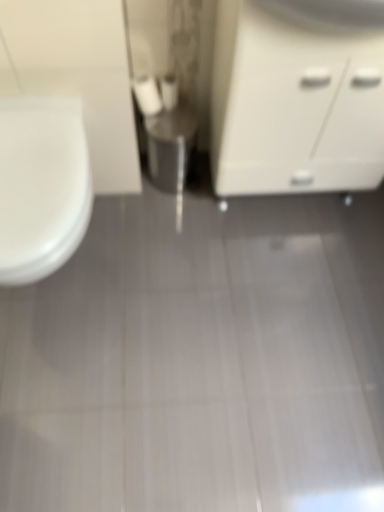
Question: Would you say white matte toilet paper at center, placed as the 1th toilet paper when sorted from right to left, is inside or outside white matte cabinet at right?

Choices:
 (A) inside
 (B) outside

Answer: (B)

Question: From a real-world perspective, is white matte toilet paper at center, placed as the 1th toilet paper when sorted from right to left, above or below white matte cabinet at right?

Choices:
 (A) above
 (B) below

Answer: (B)

Question: Which object is the closest to the white glossy toilet at left?

Choices:
 (A) white matte toilet paper at center, which is the second toilet paper in right-to-left order
 (B) white matte cabinet at right
 (C) white matte toilet paper at center, the 2th toilet paper in the left-to-right sequence

Answer: (A)

Question: Which object is positioned farthest from the white glossy toilet at left?

Choices:
 (A) white matte toilet paper at center, the first toilet paper viewed from the left
 (B) white matte cabinet at right
 (C) white matte toilet paper at center, the 2th toilet paper in the left-to-right sequence

Answer: (B)